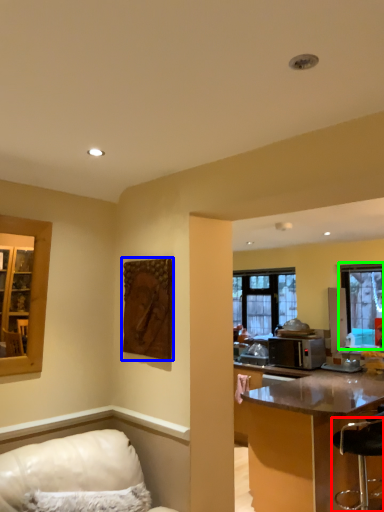
Question: Which object is the farthest from bar stool (highlighted by a red box)? Choose among these: picture frame (highlighted by a blue box) or window (highlighted by a green box).

Choices:
 (A) picture frame
 (B) window

Answer: (A)